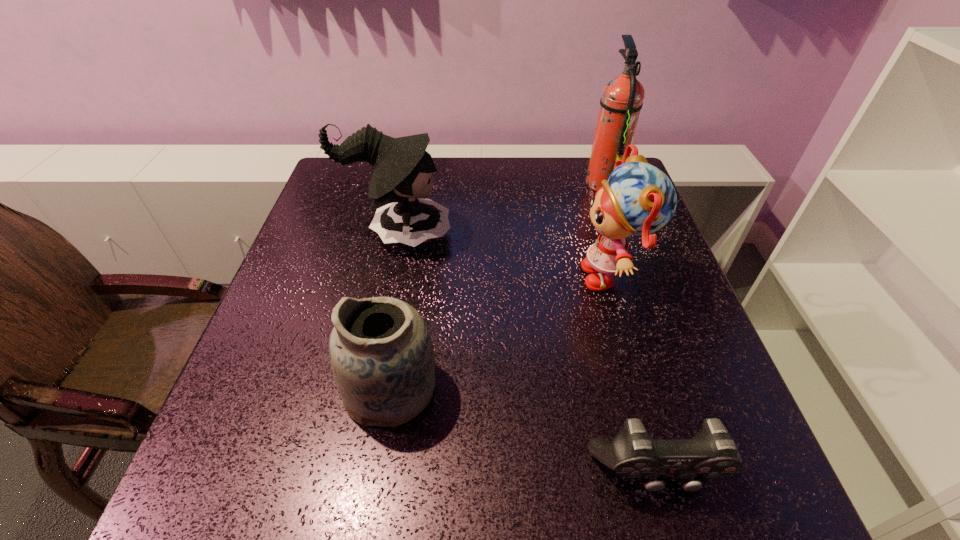
This screenshot has width=960, height=540. What are the coordinates of `unoccupied area between the fourth farthest object and the tallest object` in the screenshot? It's located at (497, 285).

Locate an element on the screen. The image size is (960, 540). free area in between the right doll and the nearest object is located at coordinates (635, 374).

Image resolution: width=960 pixels, height=540 pixels. Identify the location of empty location between the tallest object and the fourth tallest object. [x=497, y=285].

Where is `free space that is in between the fire extinguisher and the pottery`? free space that is in between the fire extinguisher and the pottery is located at coordinates (497, 285).

Locate an element on the screen. The width and height of the screenshot is (960, 540). free space that is in between the nearest object and the right doll is located at coordinates [635, 374].

Find the location of a particular element. This screenshot has height=540, width=960. unoccupied area between the farthest object and the fourth tallest object is located at coordinates (497, 285).

I want to click on blank region between the nearest object and the farthest object, so click(x=630, y=327).

Where is `the third closest object to the right doll`? Image resolution: width=960 pixels, height=540 pixels. the third closest object to the right doll is located at coordinates (401, 172).

Where is `object that is the second closest one to the farthest object`? object that is the second closest one to the farthest object is located at coordinates (401, 172).

Identify the location of blank area in the image that satisfies the following two spatial constraints: 1. at the nozzle of the tallest object; 2. on the surface of the control with buttons. The image size is (960, 540). click(x=706, y=472).